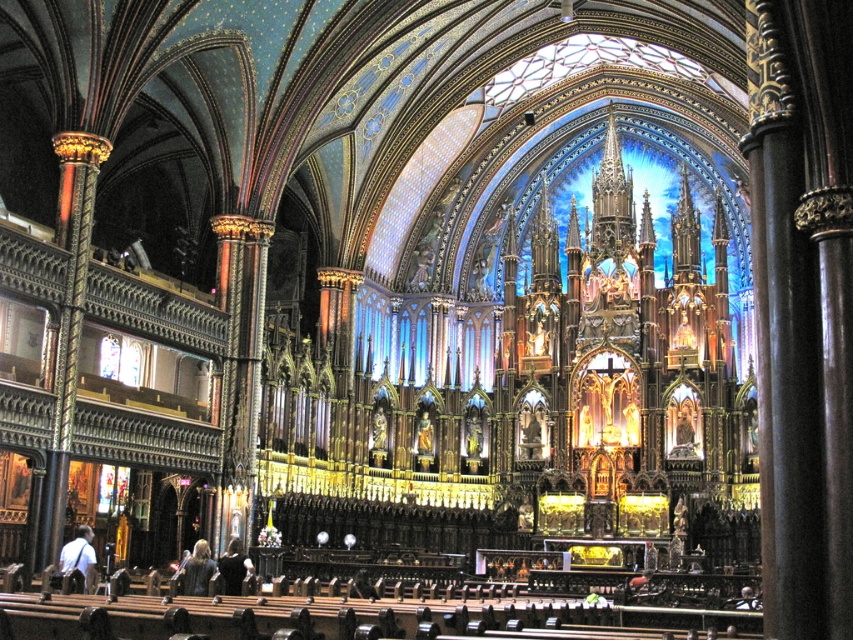
Question: Among these objects, which one is farthest from the camera?

Choices:
 (A) dark brown leather jacket at lower center
 (B) dark brown leather jacket at lower left
 (C) white fabric bag at lower left

Answer: (B)

Question: Does white fabric bag at lower left have a lesser width compared to dark brown leather jacket at lower left?

Choices:
 (A) no
 (B) yes

Answer: (A)

Question: Is dark brown leather jacket at lower center bigger than dark brown leather jacket at lower left?

Choices:
 (A) yes
 (B) no

Answer: (B)

Question: Estimate the real-world distances between objects in this image. Which object is closer to the white fabric bag at lower left?

Choices:
 (A) dark brown leather jacket at lower left
 (B) dark brown leather jacket at lower center

Answer: (B)

Question: Among these objects, which one is farthest from the camera?

Choices:
 (A) dark brown leather jacket at lower center
 (B) white fabric bag at lower left
 (C) dark brown leather jacket at lower left

Answer: (C)

Question: Is dark brown leather jacket at lower center wider than dark brown leather jacket at lower left?

Choices:
 (A) yes
 (B) no

Answer: (B)